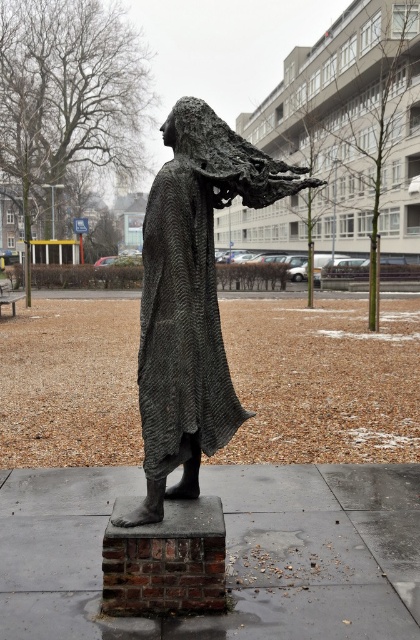
You are standing in the public square and see the bronze textured statue at center. If you walk directly towards the point at coordinates (191, 298), will you be approaching the bronze textured statue at center?

Yes, because the point at coordinates (191, 298) corresponds to the bronze textured statue at center, so approaching that point would mean moving toward the statue.

You are an art student analyzing the sculpture in the public square. You notice the bronze textured statue at center and the textured dark gray robe at center. Which object is taller?

The bronze textured statue at center is taller than the textured dark gray robe at center.

You are a maintenance worker tasked with cleaning the bronze textured statue at center and the textured dark gray robe at center. Which object should you clean first if you start from ground level and move upward?

The textured dark gray robe at center should be cleaned first since it is located below the bronze textured statue at center, which is above it.